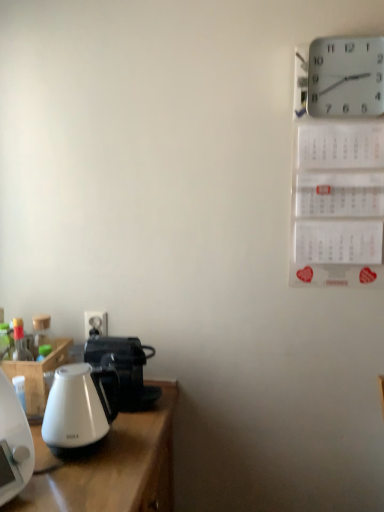
Question: Does white plastic wall clock at upper right have a larger size compared to white glossy coffee pot at lower left?

Choices:
 (A) yes
 (B) no

Answer: (B)

Question: Does white plastic wall clock at upper right come behind white glossy coffee pot at lower left?

Choices:
 (A) no
 (B) yes

Answer: (A)

Question: From the image's perspective, is white plastic wall clock at upper right on white glossy coffee pot at lower left?

Choices:
 (A) yes
 (B) no

Answer: (A)

Question: From a real-world perspective, is white plastic wall clock at upper right located beneath white glossy coffee pot at lower left?

Choices:
 (A) no
 (B) yes

Answer: (A)

Question: Does white plastic wall clock at upper right have a smaller size compared to white glossy coffee pot at lower left?

Choices:
 (A) no
 (B) yes

Answer: (B)

Question: From the image's perspective, is white plastic wall clock at upper right located beneath white glossy coffee pot at lower left?

Choices:
 (A) yes
 (B) no

Answer: (B)

Question: Could you tell me if white glossy coffee pot at lower left is turned towards white glossy kettle at left?

Choices:
 (A) no
 (B) yes

Answer: (A)

Question: Is white glossy coffee pot at lower left to the right of white glossy kettle at left from the viewer's perspective?

Choices:
 (A) yes
 (B) no

Answer: (A)

Question: Can you confirm if white glossy coffee pot at lower left is taller than white glossy kettle at left?

Choices:
 (A) no
 (B) yes

Answer: (A)

Question: Is white glossy coffee pot at lower left outside white glossy kettle at left?

Choices:
 (A) yes
 (B) no

Answer: (A)

Question: Is white glossy coffee pot at lower left thinner than white glossy kettle at left?

Choices:
 (A) yes
 (B) no

Answer: (B)

Question: Can you confirm if white glossy coffee pot at lower left is shorter than white glossy kettle at left?

Choices:
 (A) yes
 (B) no

Answer: (A)

Question: Considering the relative sizes of white plastic electric outlet at lower left and white glossy kettle at left in the image provided, is white plastic electric outlet at lower left wider than white glossy kettle at left?

Choices:
 (A) no
 (B) yes

Answer: (A)